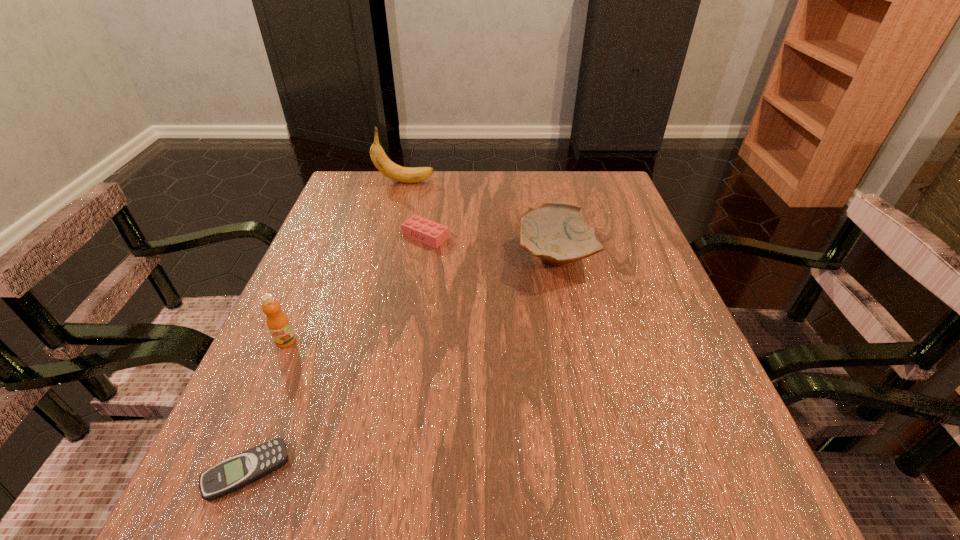
Locate an element on the screen. Image resolution: width=960 pixels, height=540 pixels. object situated at the far left corner is located at coordinates (388, 168).

Identify the location of object located at the near left corner. The width and height of the screenshot is (960, 540). (242, 469).

Locate an element on the screen. This screenshot has height=540, width=960. free location at the far edge is located at coordinates (550, 176).

I want to click on vacant space at the near edge of the desktop, so click(x=399, y=518).

The height and width of the screenshot is (540, 960). Identify the location of vacant space at the left edge of the desktop. (320, 239).

I want to click on free point at the right edge, so click(x=639, y=255).

Find the location of a particular element. The width and height of the screenshot is (960, 540). free space at the near right corner of the desktop is located at coordinates (755, 487).

Where is `free spot between the tallest object and the beeper`? This screenshot has width=960, height=540. free spot between the tallest object and the beeper is located at coordinates (326, 327).

At what (x,y) coordinates should I click in order to perform the action: click on free space between the rightmost object and the fourth shortest object. Please return your answer as a coordinate pair (x, y). Image resolution: width=960 pixels, height=540 pixels. Looking at the image, I should click on (420, 299).

This screenshot has height=540, width=960. I want to click on vacant space in between the Lego and the third shortest object, so click(491, 247).